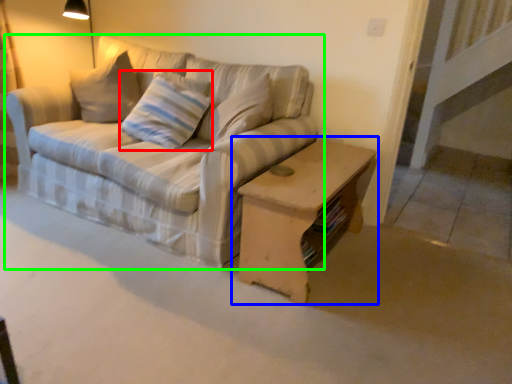
Question: Which is nearer to the pillow (highlighted by a red box)? table (highlighted by a blue box) or studio couch (highlighted by a green box).

Choices:
 (A) table
 (B) studio couch

Answer: (B)